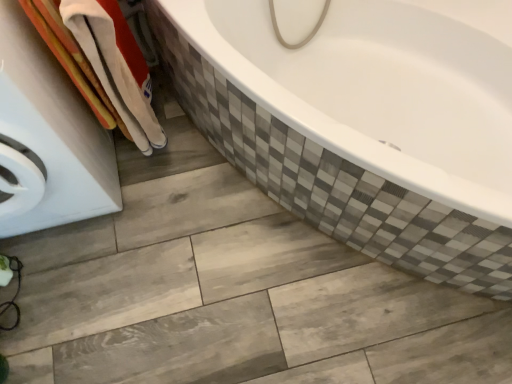
Find the location of `unoccupied area in front of white glossy washing machine at left`. unoccupied area in front of white glossy washing machine at left is located at coordinates (90, 303).